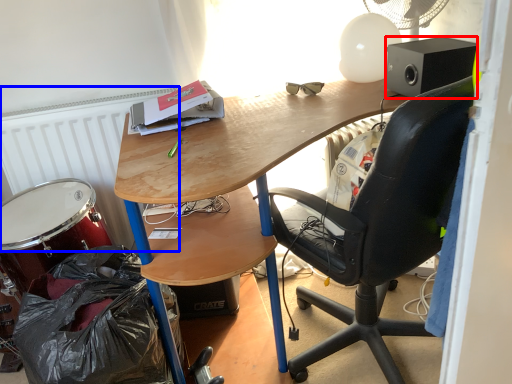
Question: Which point is closer to the camera, loudspeaker (highlighted by a red box) or radiator (highlighted by a blue box)?

Choices:
 (A) loudspeaker
 (B) radiator

Answer: (A)